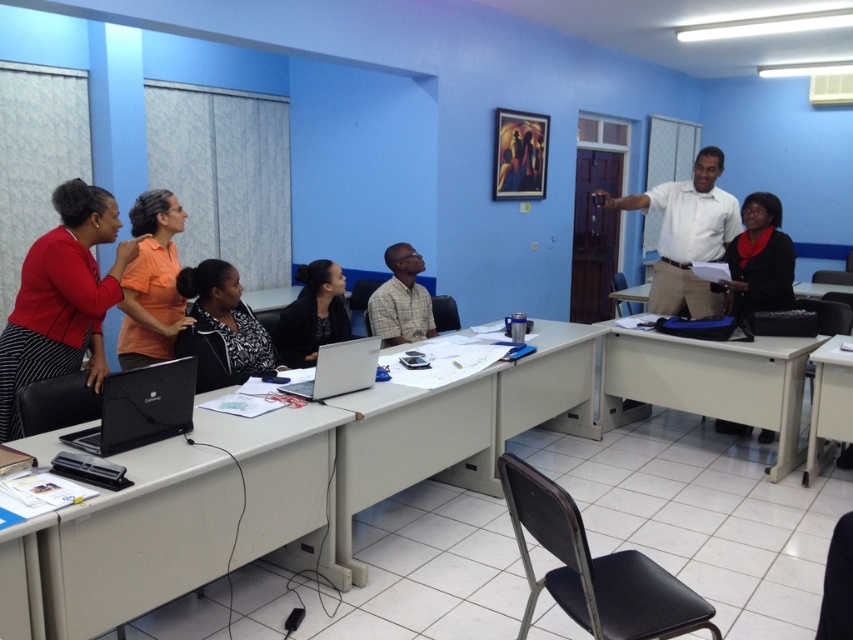
Question: Estimate the real-world distances between objects in this image. Which object is farther from the plaid shirt at center?

Choices:
 (A) silver metallic laptop at center
 (B) orange matte shirt at upper left

Answer: (B)

Question: Based on their relative distances, which object is farther from the black leather chair at lower center?

Choices:
 (A) black matte laptop at lower left
 (B) plaid shirt at center
 (C) white matte table at right
 (D) khaki pants at right

Answer: (D)

Question: Considering the relative positions of white plastic table at lower right and silver metallic laptop at center in the image provided, where is white plastic table at lower right located with respect to silver metallic laptop at center?

Choices:
 (A) right
 (B) left

Answer: (A)

Question: Which object appears farthest from the camera in this image?

Choices:
 (A) white laminate table at lower left
 (B) black matte jacket at center
 (C) khaki pants at right
 (D) black leather chair at lower center

Answer: (C)

Question: Is the position of white matte table at right more distant than that of plaid shirt at center?

Choices:
 (A) no
 (B) yes

Answer: (A)

Question: Does white matte table at right lie behind orange matte shirt at upper left?

Choices:
 (A) no
 (B) yes

Answer: (B)